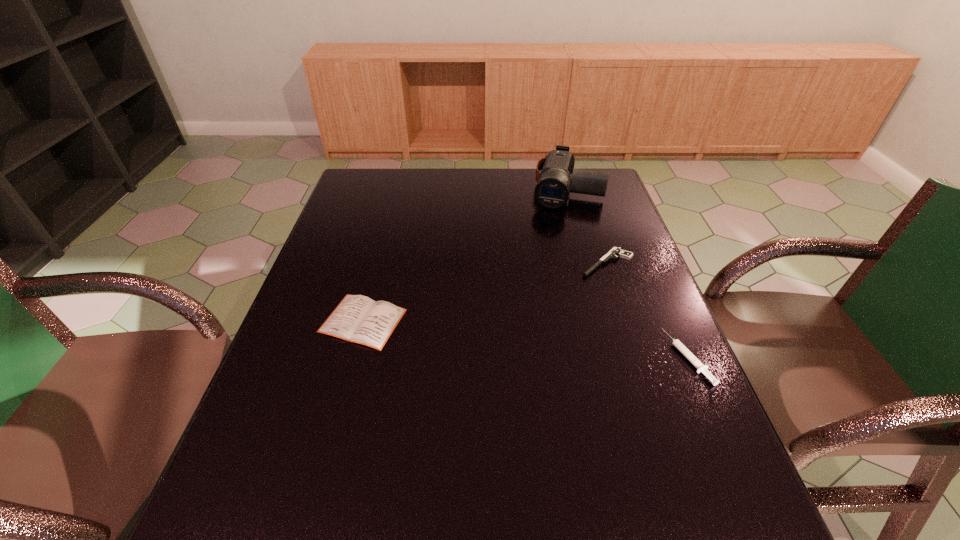
Find the location of a particular element. This screenshot has height=540, width=960. free point between the syringe and the leftmost object is located at coordinates (525, 339).

The image size is (960, 540). I want to click on empty location between the third nearest object and the leftmost object, so click(x=485, y=292).

Where is `vacant point located between the tallest object and the pistol`? vacant point located between the tallest object and the pistol is located at coordinates (587, 226).

Locate an element on the screen. This screenshot has width=960, height=540. vacant space that is in between the diary and the third nearest object is located at coordinates (485, 292).

This screenshot has height=540, width=960. Identify the location of unoccupied position between the farthest object and the shortest object. click(x=587, y=226).

Where is `object that is the closest to the syringe`? This screenshot has height=540, width=960. object that is the closest to the syringe is located at coordinates (616, 251).

You are a GUI agent. You are given a task and a screenshot of the screen. Output one action in this format:
    pyautogui.click(x=<x>, y=<y>)
    Task: Click on the second closest object relative to the leftmost object
    
    Given the screenshot: What is the action you would take?
    pyautogui.click(x=552, y=191)

Image resolution: width=960 pixels, height=540 pixels. What are the coordinates of `free space in the image that satisfies the following two spatial constraints: 1. on the front side of the syringe; 2. on the right side of the third nearest object` in the screenshot? It's located at (638, 357).

I want to click on vacant region that satisfies the following two spatial constraints: 1. on the back side of the shortest object; 2. on the right side of the leftmost object, so click(378, 263).